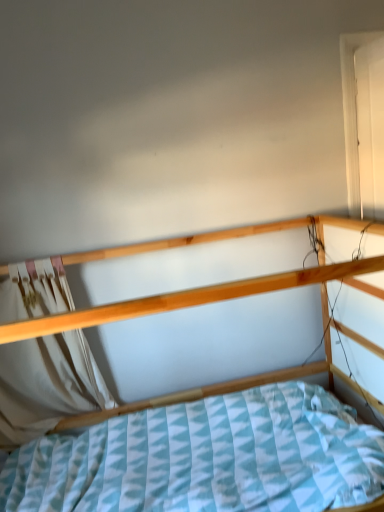
This screenshot has width=384, height=512. What do you see at coordinates (352, 113) in the screenshot?
I see `white wood door at upper right` at bounding box center [352, 113].

This screenshot has width=384, height=512. What do you see at coordinates (47, 385) in the screenshot?
I see `white fabric curtain at left` at bounding box center [47, 385].

Measure the distance between point (x=111, y=403) and camera.

The depth of point (x=111, y=403) is 7.38 feet.

You are a GUI agent. You are given a task and a screenshot of the screen. Output one action in this format:
    pyautogui.click(x=<x>, y=<y>)
    Task: Click on the white wood door at upper right
    
    Given the screenshot: What is the action you would take?
    pyautogui.click(x=352, y=113)

Considering the relative positions of white wood door at upper right and wooden bed at center in the image provided, is white wood door at upper right to the left of wooden bed at center from the viewer's perspective?

No.

From a real-world perspective, between white wood door at upper right and wooden bed at center, who is vertically lower?

wooden bed at center is physically lower.

Is white wood door at upper right wider than wooden bed at center?

No.

Considering the sizes of white wood door at upper right and wooden bed at center in the image, is white wood door at upper right bigger or smaller than wooden bed at center?

white wood door at upper right is smaller than wooden bed at center.

From the picture: Considering the relative positions of wooden bed at center and white wood door at upper right in the image provided, is wooden bed at center to the left or to the right of white wood door at upper right?

Based on their positions, wooden bed at center is located to the left of white wood door at upper right.

From the image's perspective, between wooden bed at center and white wood door at upper right, which one is located above?

white wood door at upper right appears higher in the image.

Which object is wider, wooden bed at center or white wood door at upper right?

With larger width is wooden bed at center.

Considering the positions of objects wooden bed at center and white fabric curtain at left in the image provided, who is in front, wooden bed at center or white fabric curtain at left?

wooden bed at center is more forward.

Can you confirm if wooden bed at center is taller than white fabric curtain at left?

Yes.

This screenshot has width=384, height=512. Identify the location of bed that is in front of the white fabric curtain at left. (195, 298).

Which object is positioned more to the left, wooden bed at center or white fabric curtain at left?

Positioned to the left is white fabric curtain at left.

From a real-world perspective, is white fabric curtain at left under wooden bed at center?

Incorrect, from a real-world perspective, white fabric curtain at left is higher than wooden bed at center.

In the scene shown: Is white fabric curtain at left further to the viewer compared to wooden bed at center?

Yes.

Can you confirm if white fabric curtain at left is bigger than wooden bed at center?

Actually, white fabric curtain at left might be smaller than wooden bed at center.

From the picture: Is white fabric curtain at left directly adjacent to wooden bed at center?

No, white fabric curtain at left is not making contact with wooden bed at center.

Is point (68, 350) farther from viewer compared to point (351, 34)?

No, (68, 350) is in front of (351, 34).

In terms of width, does white fabric curtain at left look wider or thinner when compared to white wood door at upper right?

Clearly, white fabric curtain at left has less width compared to white wood door at upper right.

Are white fabric curtain at left and white wood door at upper right beside each other?

No, white fabric curtain at left is not next to white wood door at upper right.

Is white wood door at upper right positioned with its back to white fabric curtain at left?

That's right, white wood door at upper right is facing away from white fabric curtain at left.

Are white wood door at upper right and white fabric curtain at left located far from each other?

Absolutely, white wood door at upper right is distant from white fabric curtain at left.

Which object is positioned more to the left, white wood door at upper right or white fabric curtain at left?

white fabric curtain at left.

In terms of width, does white wood door at upper right look wider or thinner when compared to white fabric curtain at left?

Considering their sizes, white wood door at upper right looks broader than white fabric curtain at left.

At what (x,y) coordinates should I click in order to perform the action: click on window above the wooden bed at center (from the image's perspective). Please return your answer as a coordinate pair (x, y). The height and width of the screenshot is (512, 384). Looking at the image, I should click on (352, 113).

In the image, there is a white wood door at upper right. At what (x,y) coordinates should I click in order to perform the action: click on bed below it (from the image's perspective). Please return your answer as a coordinate pair (x, y). This screenshot has width=384, height=512. Looking at the image, I should click on (195, 298).

From the image, which object appears to be nearer to white wood door at upper right, white fabric curtain at left or wooden bed at center?

Based on the image, wooden bed at center appears to be nearer to white wood door at upper right.

From the image, which object appears to be farther from white wood door at upper right, wooden bed at center or white fabric curtain at left?

Based on the image, white fabric curtain at left appears to be further to white wood door at upper right.

From the image, which object appears to be nearer to white fabric curtain at left, white wood door at upper right or wooden bed at center?

The object closer to white fabric curtain at left is wooden bed at center.

From the image, which object appears to be farther from wooden bed at center, white wood door at upper right or white fabric curtain at left?

Among the two, white wood door at upper right is located further to wooden bed at center.

Which object lies further to the anchor point wooden bed at center, white fabric curtain at left or white wood door at upper right?

white wood door at upper right lies further to wooden bed at center than the other object.

Estimate the real-world distances between objects in this image. Which object is closer to white fabric curtain at left, wooden bed at center or white wood door at upper right?

wooden bed at center is closer to white fabric curtain at left.

Identify the location of bed situated between white fabric curtain at left and white wood door at upper right from left to right. (195, 298).